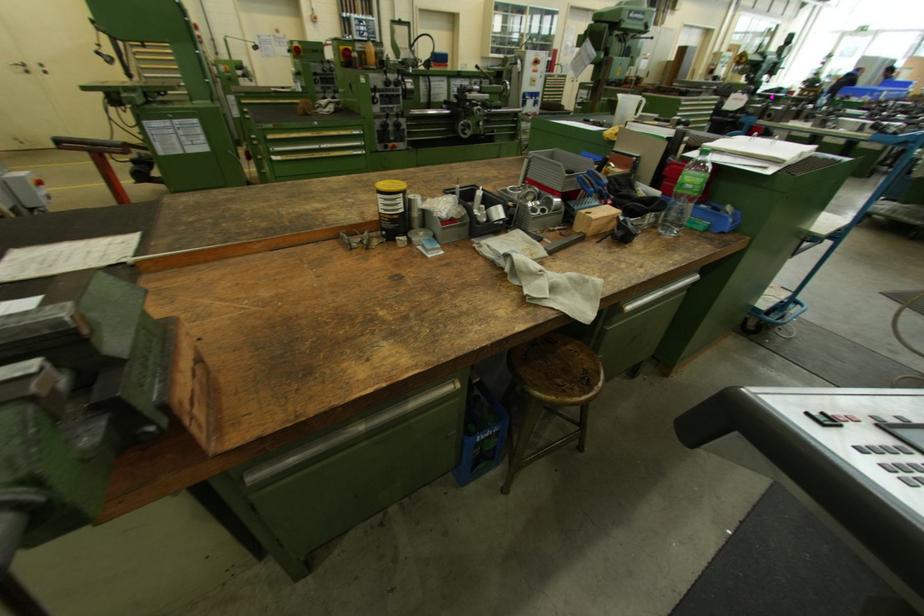
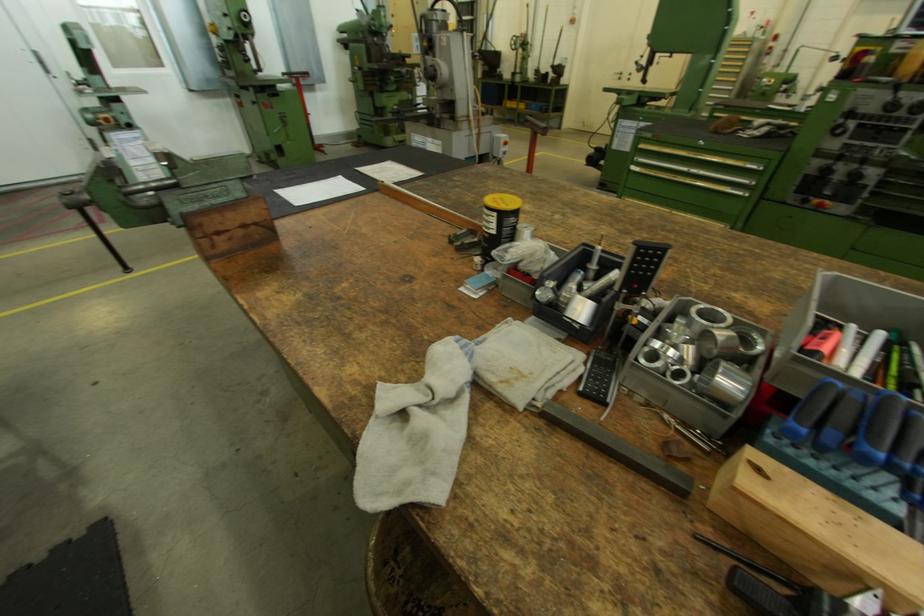
Based on the continuous images, in which direction is the camera rotating?

The camera rotated toward left-down.